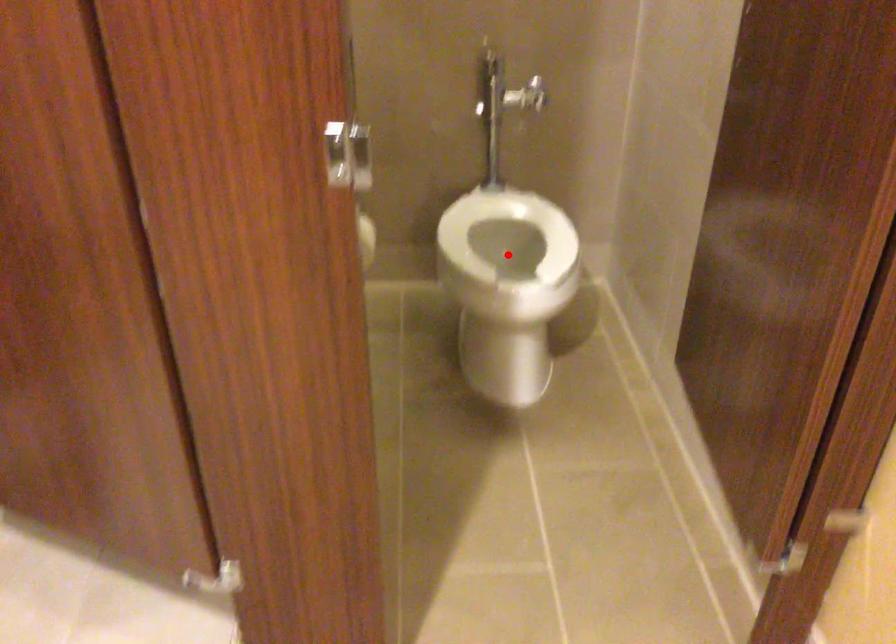
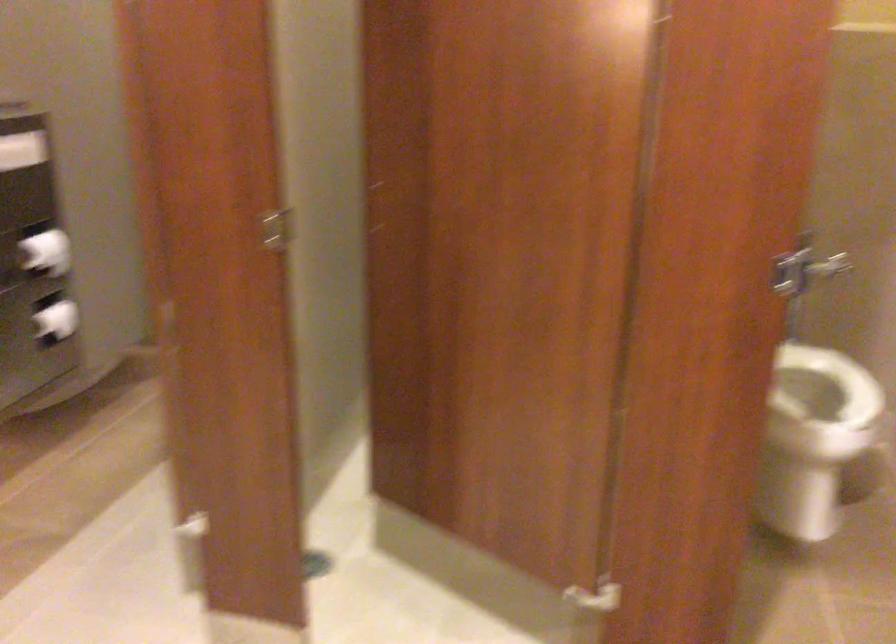
The point at the highlighted location is marked in the first image. Where is the corresponding point in the second image?

(811, 393)